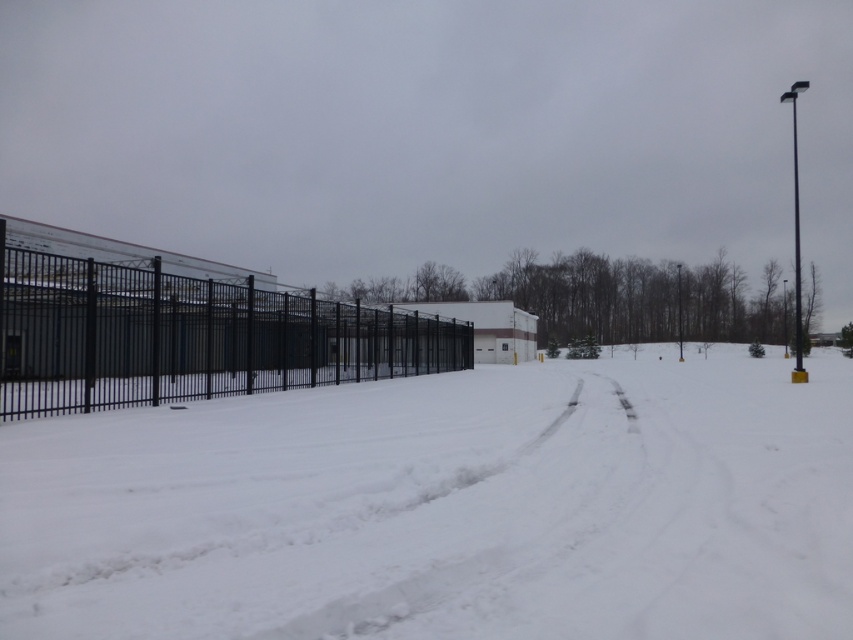
You are a snowplow driver who needs to clear the snow between the white powdery snow at center and the black metal fence at left. The snowplow has a maximum reach of 30 feet. Can you clear the snow in that area without moving the plow?

The distance between the white powdery snow at center and the black metal fence at left is 30.90 feet, which exceeds the snowplow maximum reach of 30 feet. Therefore, the snowplow cannot clear the snow in that area without moving the plow.

You are a snowplow driver needing to clear the snow from the area. You see the white powdery snow at center and the black metal fence at left. Which object is lower in height?

The white powdery snow at center is shorter than the black metal fence at left, so the white powdery snow at center is lower in height.